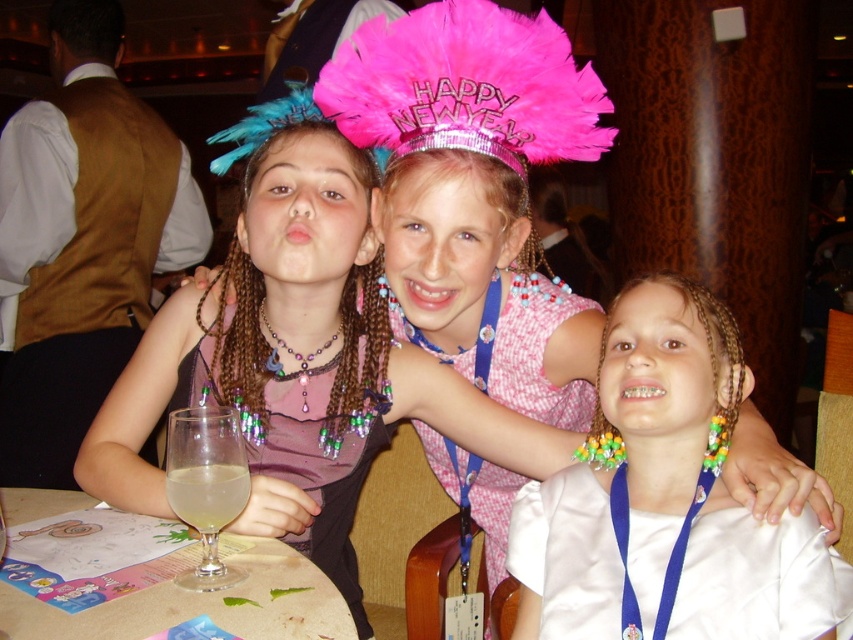
You are a photographer at the event and want to take a photo of the pink feathered crown at center and the purple satin dress at center. The camera has a focus range of 18 inches. Will both items be in focus?

The pink feathered crown at center is 18.24 inches from the purple satin dress at center. Since the camera can focus within 18 inches, the distance between them is slightly beyond the focus range. Therefore, both items may not be in focus simultaneously.

Based on the coordinates provided, what object is located at point (199, 605) in the image?

The point (199, 605) corresponds to the wooden table at center.

You are a waiter at this New Year celebration. You need to place a new dessert plate on the wooden table at center. However, there is a clear glass wine glass at lower left in the way. Can you place the plate on the table without moving the glass?

The wooden table at center is below the clear glass wine glass at lower left, meaning the glass is on the table. Therefore, you can place the dessert plate on the wooden table at center alongside the clear glass wine glass at lower left without needing to move it.